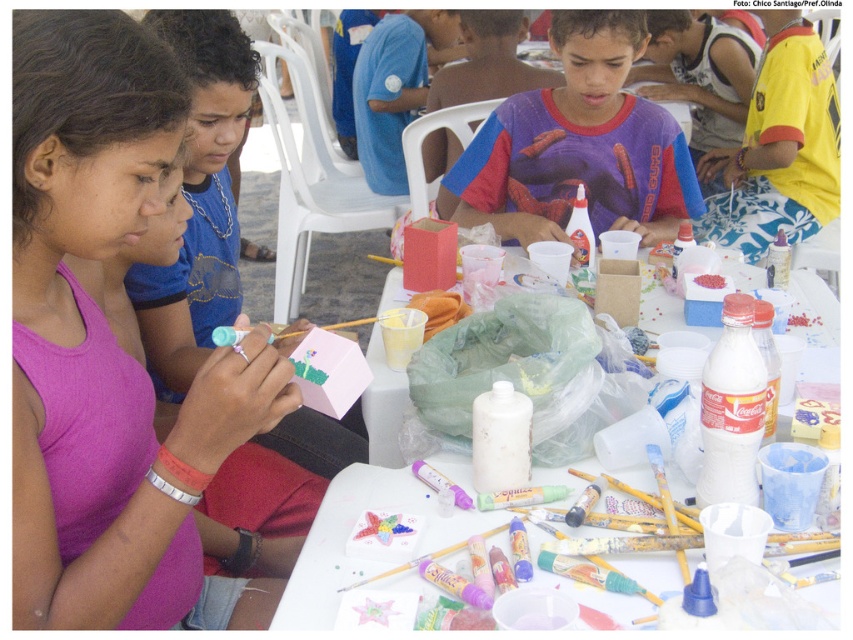
You are organizing an art class and need to arrange materials for students. You have a matte pink paper at center and a blue cotton shirt at upper center. Which item is located to the left of the other?

The matte pink paper at center is positioned on the left side of blue cotton shirt at upper center.